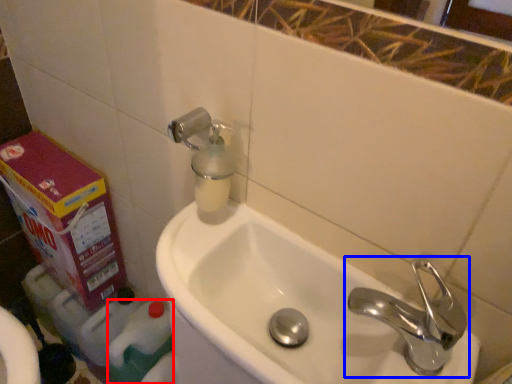
Question: Which of the following is the farthest to the observer, cleaning product (highlighted by a red box) or tap (highlighted by a blue box)?

Choices:
 (A) cleaning product
 (B) tap

Answer: (A)